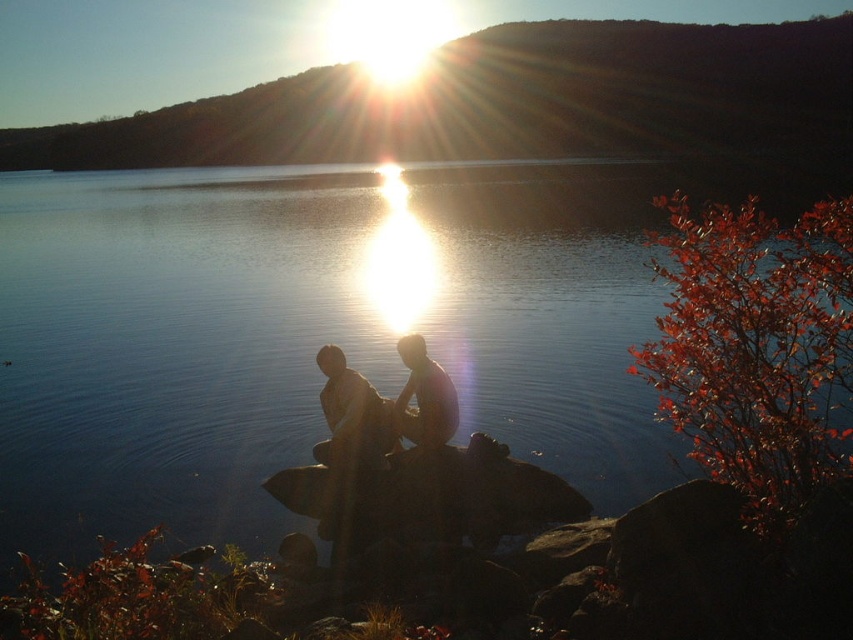
Who is lower down, transparent water at center or matte brown couple at center?

matte brown couple at center is lower down.

Who is higher up, transparent water at center or matte brown couple at center?

transparent water at center is higher up.

Locate an element on the screen. transparent water at center is located at coordinates (311, 332).

Looking at this image, can you confirm if matte brown couple at center is bigger than smooth skin man at center?

Correct, matte brown couple at center is larger in size than smooth skin man at center.

Which is below, matte brown couple at center or smooth skin man at center?

matte brown couple at center

Which is in front, point (345, 404) or point (398, 424)?

Point (345, 404)

This screenshot has height=640, width=853. Identify the location of matte brown couple at center. (384, 406).

Does transparent water at center have a greater width compared to smooth skin man at center?

Indeed, transparent water at center has a greater width compared to smooth skin man at center.

Can you confirm if transparent water at center is smaller than smooth skin man at center?

Actually, transparent water at center might be larger than smooth skin man at center.

Which is in front, point (233, 323) or point (450, 394)?

Positioned in front is point (450, 394).

The width and height of the screenshot is (853, 640). I want to click on transparent water at center, so click(311, 332).